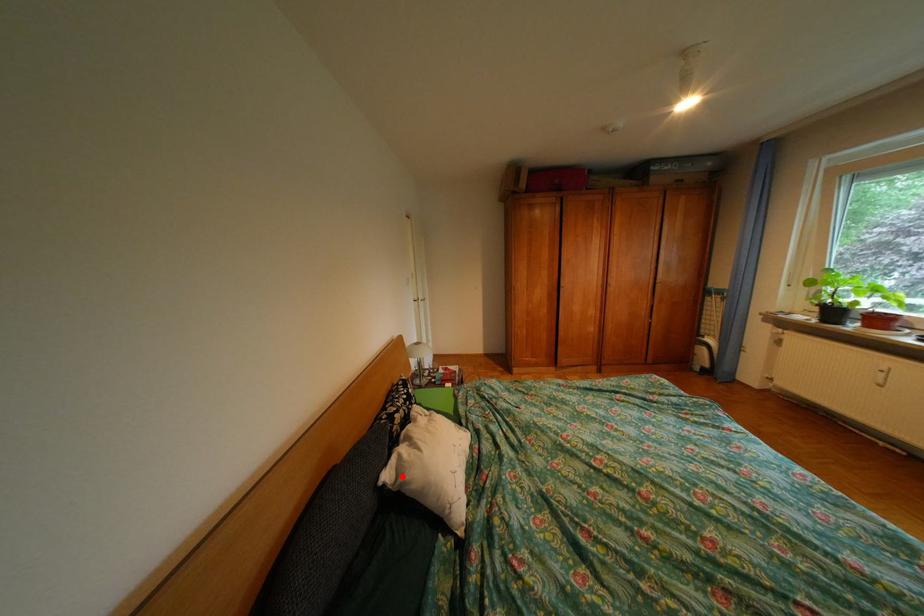
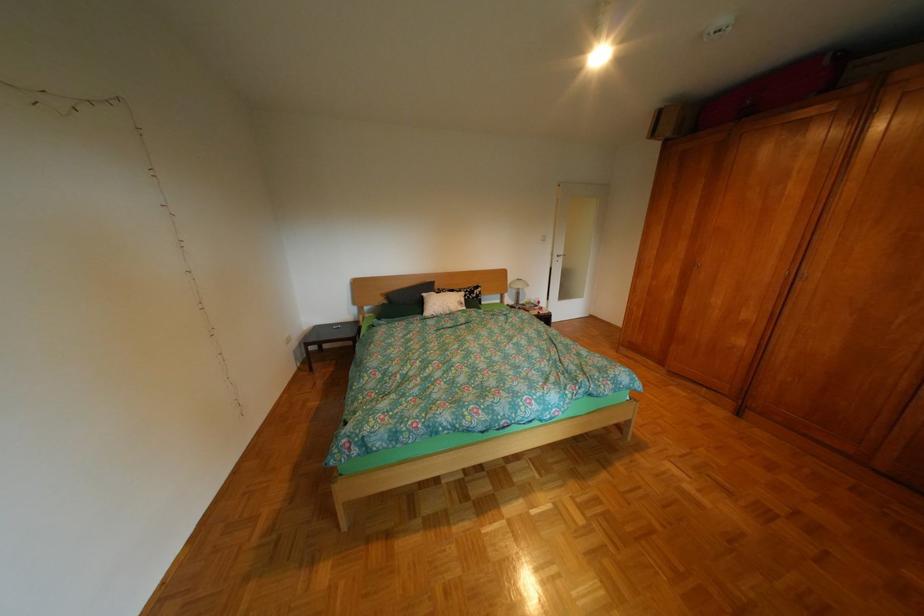
Question: A red point is marked in image1. In image2, is the corresponding 3D point closer to the camera or farther? Reply with the corresponding letter.

Choices:
 (A) The corresponding 3D point is closer.
 (B) The corresponding 3D point is farther.

Answer: (A)